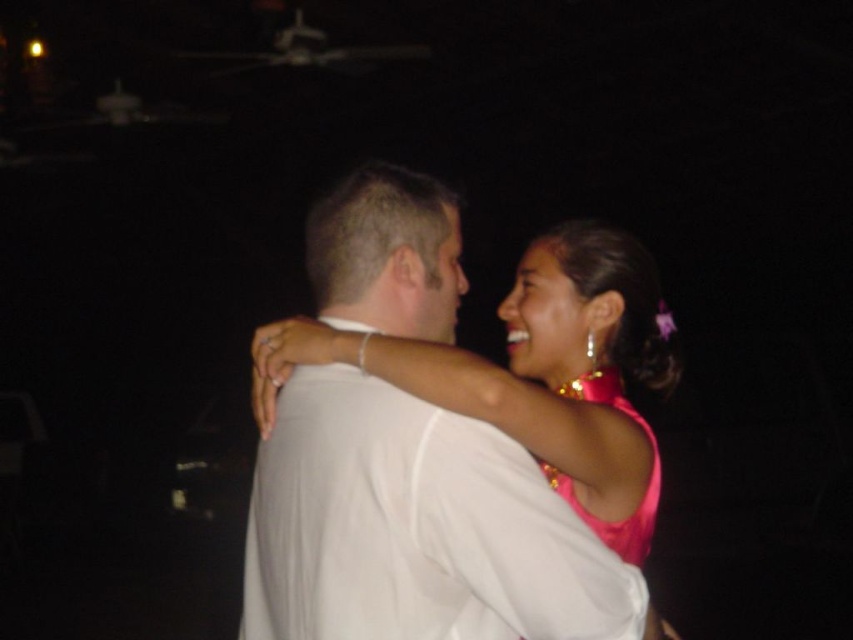
You are a photographer at a wedding reception. You need to capture a photo of the two people in the image. The pink satin dress at center and the pink satin dress at upper right are both in the frame. Which dress should you focus on to ensure it takes up more space in the photo?

The pink satin dress at center should be focused on because its width surpasses that of the pink satin dress at upper right, meaning it occupies more space in the frame.